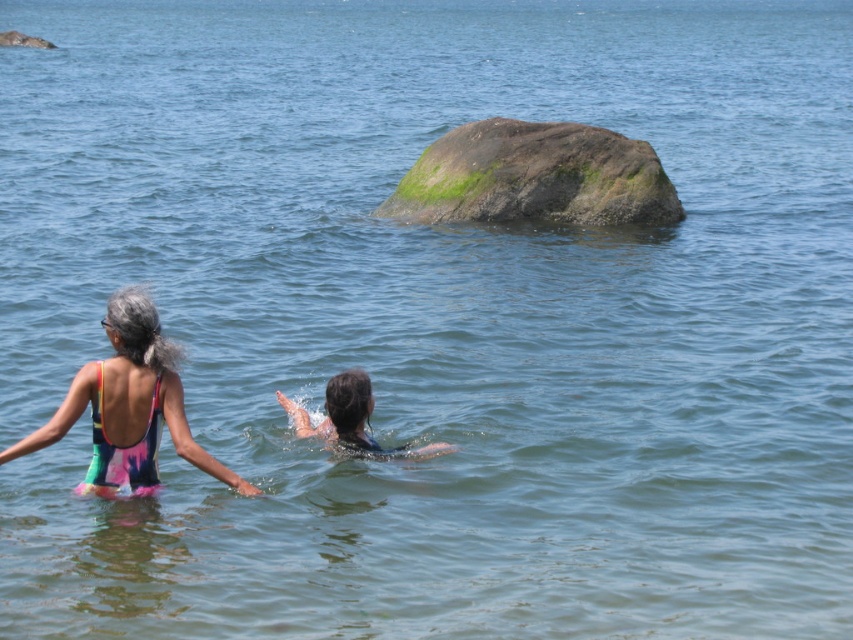
Is green mossy rock at center positioned at the back of dark blue swimsuit at center?

Yes.

Is point (643, 211) positioned after point (340, 412)?

Yes, it is behind point (340, 412).

This screenshot has width=853, height=640. What are the coordinates of `green mossy rock at center` in the screenshot? It's located at (534, 177).

Looking at this image, can you confirm if dark blue swimsuit at center is wider than green mossy rock at upper left?

No, dark blue swimsuit at center is not wider than green mossy rock at upper left.

Who is more distant from viewer, [364,374] or [20,44]?

The point [20,44] is more distant.

Who is more distant from viewer, [352,384] or [16,36]?

Point [16,36]

In order to click on dark blue swimsuit at center in this screenshot , I will do `click(349, 417)`.

Looking at this image, does multicolored fabric swimsuit at left come behind dark blue swimsuit at center?

No, multicolored fabric swimsuit at left is closer to the viewer.

Who is positioned more to the left, multicolored fabric swimsuit at left or dark blue swimsuit at center?

From the viewer's perspective, multicolored fabric swimsuit at left appears more on the left side.

Which is in front, point (120, 472) or point (283, 396)?

Positioned in front is point (120, 472).

At what (x,y) coordinates should I click in order to perform the action: click on multicolored fabric swimsuit at left. Please return your answer as a coordinate pair (x, y). This screenshot has width=853, height=640. Looking at the image, I should click on (122, 451).